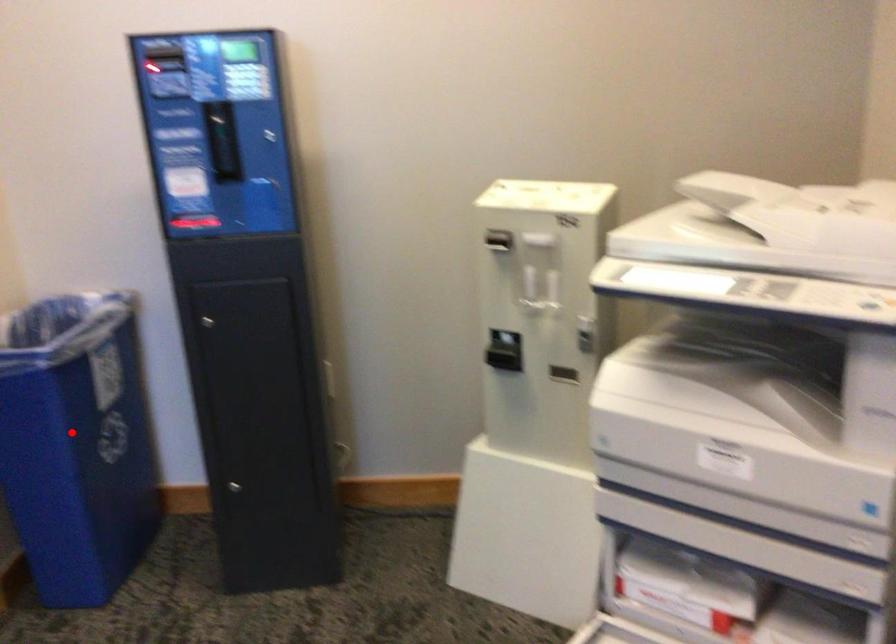
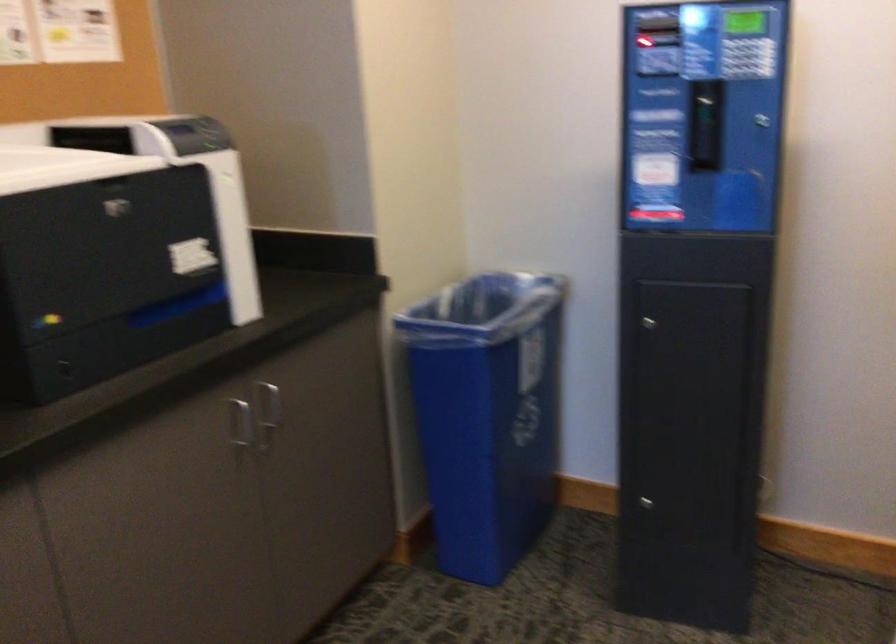
In the second image, find the point that corresponds to the highlighted location in the first image.

(487, 413)